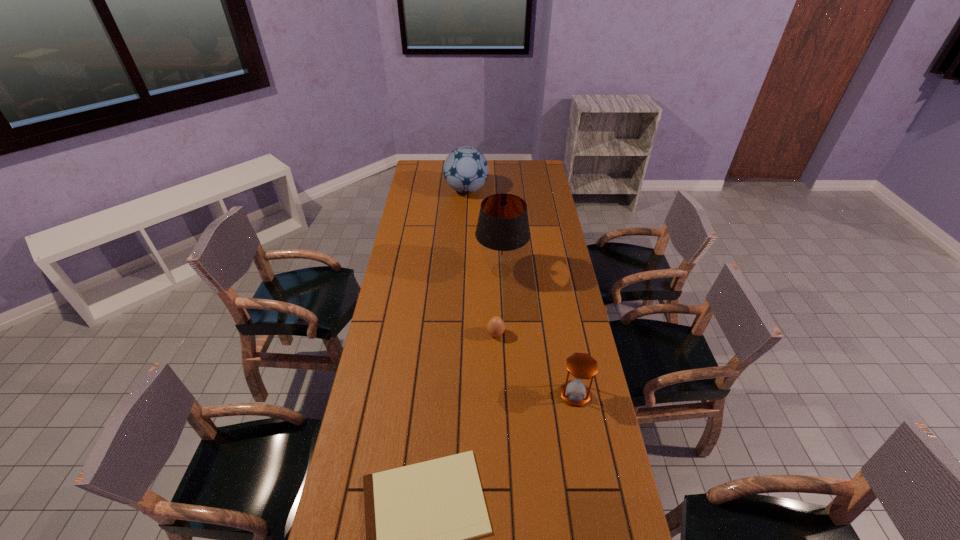
The image size is (960, 540). What are the coordinates of `free space between the soccer ball and the rightmost object` in the screenshot? It's located at (521, 292).

Where is `the third closest object relative to the fourth farthest object`? the third closest object relative to the fourth farthest object is located at coordinates (502, 230).

Point out which object is positioned as the second nearest to the soccer ball. Please provide its 2D coordinates. Your answer should be formatted as a tuple, i.e. [(x, y)], where the tuple contains the x and y coordinates of a point satisfying the conditions above.

[(496, 326)]

Find the location of a particular element. free space that satisfies the following two spatial constraints: 1. on the side with brand of the soccer ball; 2. on the back side of the rightmost object is located at coordinates coord(458,394).

Image resolution: width=960 pixels, height=540 pixels. I want to click on blank space that satisfies the following two spatial constraints: 1. on the side with brand of the rightmost object; 2. on the left side of the fourth shortest object, so click(x=458, y=394).

You are a GUI agent. You are given a task and a screenshot of the screen. Output one action in this format:
    pyautogui.click(x=<x>, y=<y>)
    Task: Click on the free space in the image that satisfies the following two spatial constraints: 1. on the back side of the second shortest object; 2. on the side with brand of the farthest object
    The height and width of the screenshot is (540, 960).
    Given the screenshot: What is the action you would take?
    pyautogui.click(x=491, y=190)

What are the coordinates of `vacant area in the image that satisfies the following two spatial constraints: 1. on the side with brand of the farthest object; 2. on the back side of the third nearest object` in the screenshot? It's located at (460, 334).